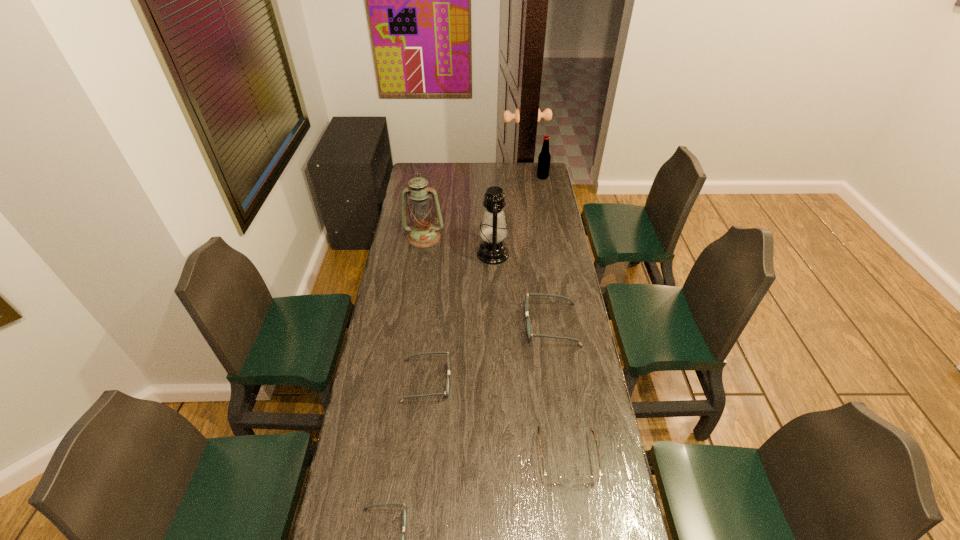
Identify the location of vacant space that's between the beer bottle and the second nearest gray spectacles. The image size is (960, 540). (485, 279).

I want to click on vacant area between the brown spectacles and the farthest object, so click(x=555, y=317).

I want to click on empty space between the beer bottle and the black oil lamp, so click(x=517, y=215).

Locate an element on the screen. empty space that is in between the rightmost gray spectacles and the beer bottle is located at coordinates (547, 251).

You are a GUI agent. You are given a task and a screenshot of the screen. Output one action in this format:
    pyautogui.click(x=<x>, y=<y>)
    Task: Click on the object that ranks as the sixth closest to the left oil lamp
    The height and width of the screenshot is (540, 960).
    Given the screenshot: What is the action you would take?
    pyautogui.click(x=365, y=508)

This screenshot has height=540, width=960. Find the location of `object that is the fourth closest to the rightmost gray spectacles`. object that is the fourth closest to the rightmost gray spectacles is located at coordinates click(x=423, y=234).

What are the coordinates of `spectacles identified as the fourth closest to the beer bottle` in the screenshot? It's located at (365, 508).

What are the coordinates of `spectacles that can be found as the closest to the fifth farthest object` in the screenshot? It's located at (528, 323).

I want to click on gray spectacles that is the nearest to the black oil lamp, so click(528, 323).

Locate which gray spectacles ranks in proximity to the third tallest object. Please provide its 2D coordinates. Your answer should be formatted as a tuple, i.e. [(x, y)], where the tuple contains the x and y coordinates of a point satisfying the conditions above.

[(528, 323)]